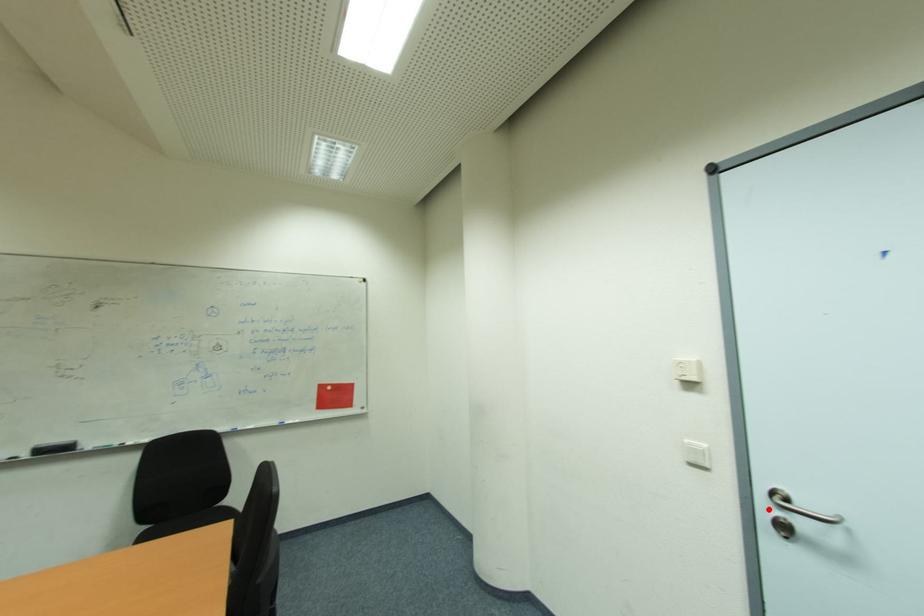
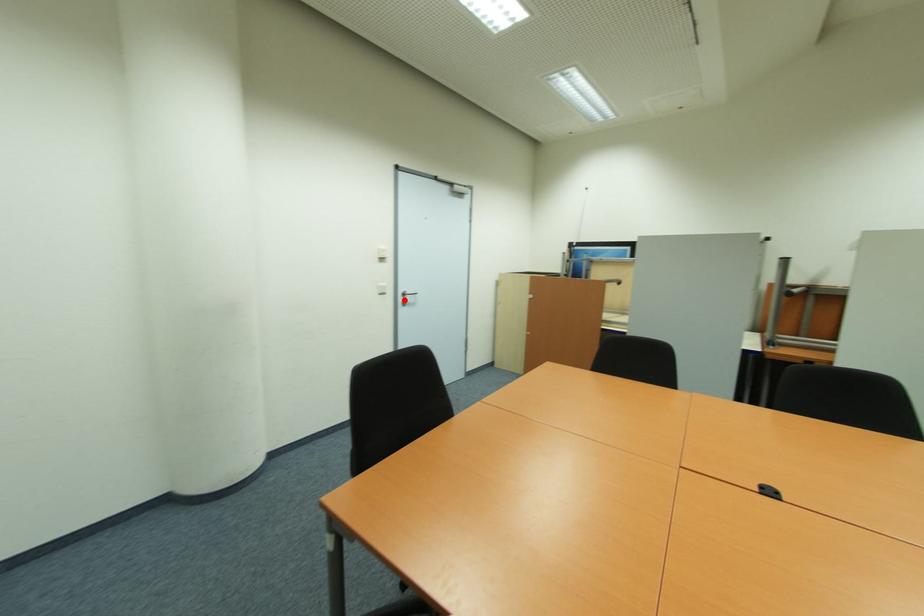
Consider the image. I am providing you with two images of the same scene from different viewpoints. A red point is marked on the first image and another point is marked on the second image. Is the red point in image1 aligned with the point shown in image2?

Yes